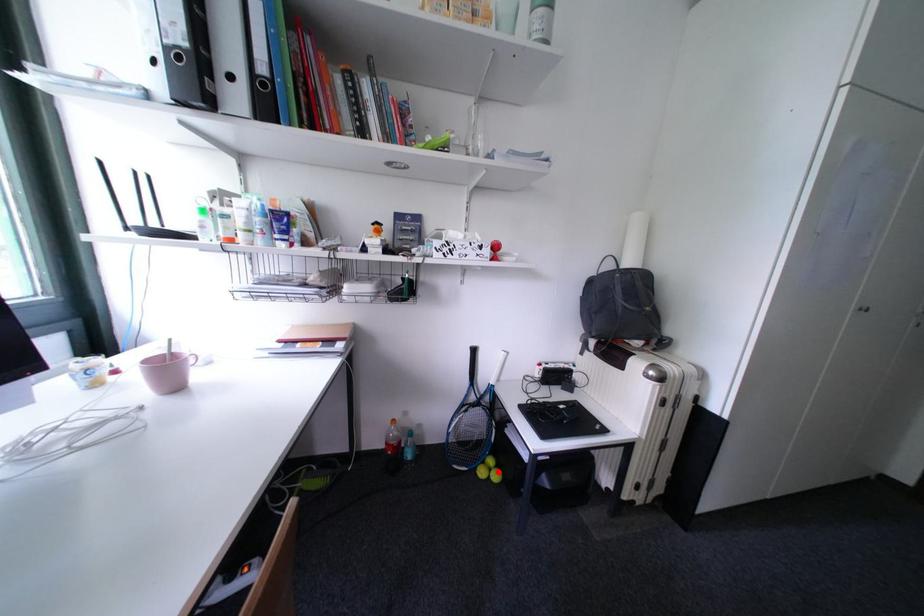
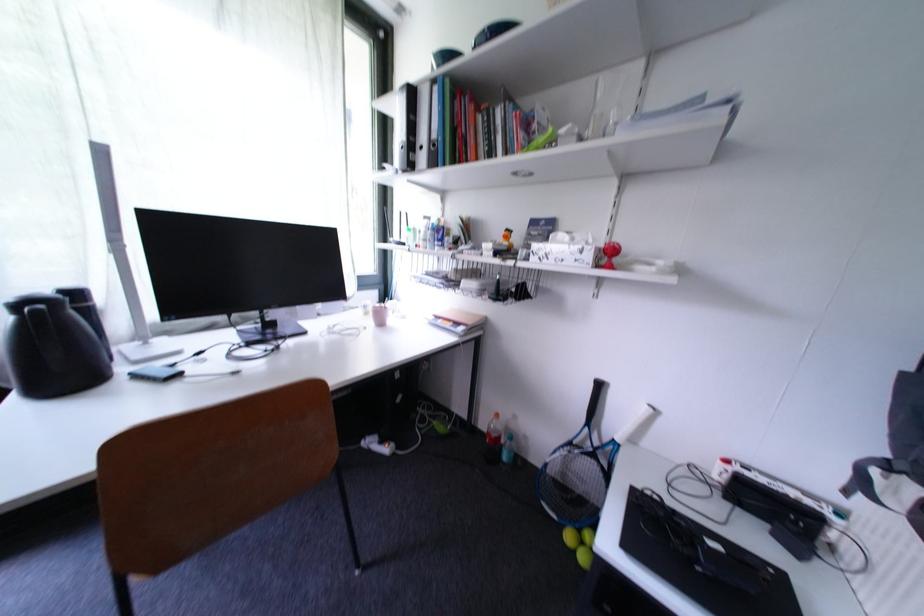
Question: I am providing you with two images of the same scene from different viewpoints. Given a red point in image1, look at the same physical point in image2. Is it:

Choices:
 (A) Closer to the viewpoint
 (B) Farther from the viewpoint

Answer: (A)